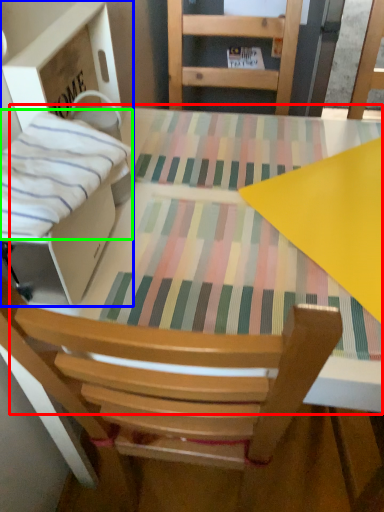
Question: Which object is the closest to the round table (highlighted by a red box)? Choose among these: cardboard box (highlighted by a blue box) or blanket (highlighted by a green box).

Choices:
 (A) cardboard box
 (B) blanket

Answer: (A)